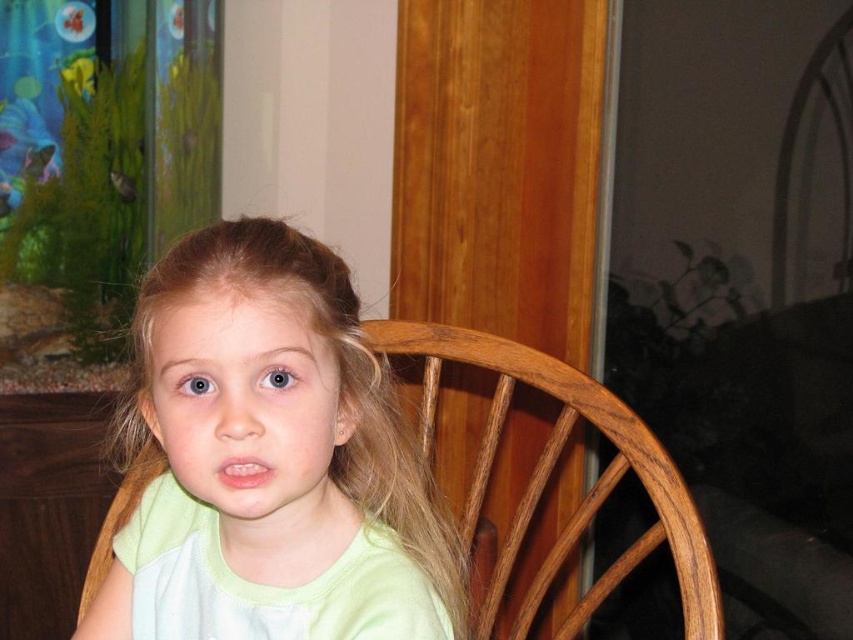
Question: Observing the image, what is the correct spatial positioning of wooden chair at center in reference to green matte fish at upper left?

Choices:
 (A) below
 (B) above

Answer: (A)

Question: Among these objects, which one is farthest from the camera?

Choices:
 (A) shiny green fish at upper left
 (B) green matte fish at upper left
 (C) wooden chair at center

Answer: (A)

Question: Is wooden chair at center bigger than shiny silver fish at upper left?

Choices:
 (A) yes
 (B) no

Answer: (A)

Question: Which point is farther to the camera?

Choices:
 (A) green matte fish at upper left
 (B) wooden chair at center
 (C) shiny green fish at upper left

Answer: (C)

Question: Observing the image, what is the correct spatial positioning of wooden chair at center in reference to green matte fish at upper left?

Choices:
 (A) below
 (B) above

Answer: (A)

Question: Which object is farther from the camera taking this photo?

Choices:
 (A) wooden chair at center
 (B) shiny green fish at upper left
 (C) shiny silver fish at upper left

Answer: (C)